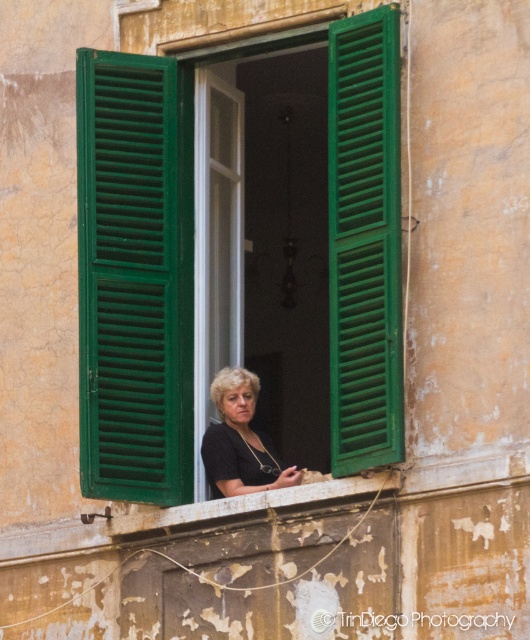
Question: Which of the following is the farthest from the observer?

Choices:
 (A) (272, 486)
 (B) (149, 461)
 (C) (375, 403)

Answer: (B)

Question: Among these points, which one is nearest to the camera?

Choices:
 (A) (351, 372)
 (B) (385, 294)
 (C) (145, 339)

Answer: (B)

Question: Is green matte shutters at center below green painted wood shutter at center?

Choices:
 (A) yes
 (B) no

Answer: (A)

Question: Can you confirm if green matte shutters at center is positioned to the right of black matte shirt at center?

Choices:
 (A) no
 (B) yes

Answer: (A)

Question: Considering the real-world distances, which object is farthest from the green painted wood shutter at center?

Choices:
 (A) green matte shutters at center
 (B) black matte shirt at center
 (C) green wooden shutters at center

Answer: (B)

Question: Is green matte shutters at center bigger than green painted wood shutter at center?

Choices:
 (A) yes
 (B) no

Answer: (B)